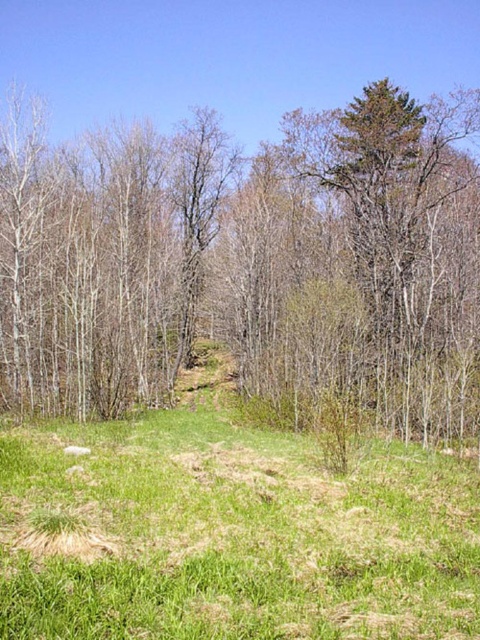
Question: Is brown bark tree at center thinner than green grass at lower center?

Choices:
 (A) yes
 (B) no

Answer: (B)

Question: Can you confirm if brown bark tree at center is positioned to the left of green grass at lower center?

Choices:
 (A) no
 (B) yes

Answer: (B)

Question: Which object is closer to the camera taking this photo?

Choices:
 (A) green grass at lower center
 (B) brown bark tree at center

Answer: (A)

Question: Considering the relative positions of brown bark tree at center and green grass at lower center in the image provided, where is brown bark tree at center located with respect to green grass at lower center?

Choices:
 (A) left
 (B) right

Answer: (A)

Question: Which of the following is the closest to the observer?

Choices:
 (A) brown bark tree at center
 (B) green grass at lower center

Answer: (B)

Question: Which of the following is the closest to the observer?

Choices:
 (A) (32, 301)
 (B) (478, 611)

Answer: (B)